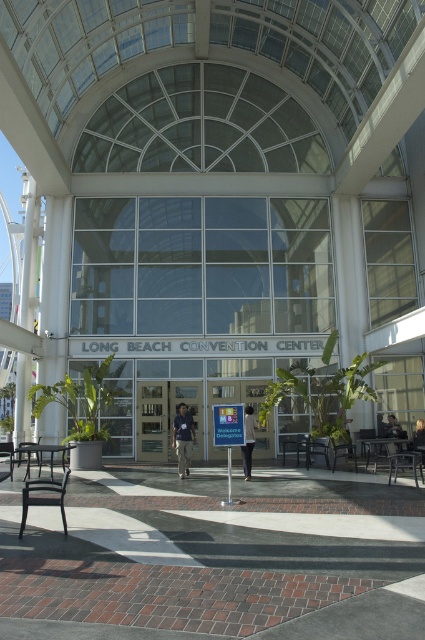
Question: Which of the following is the closest to the observer?

Choices:
 (A) (178, 436)
 (B) (17, 410)
 (C) (249, 477)
 (D) (422, 422)

Answer: (C)

Question: Based on their relative distances, which object is farther from the light brown leather jacket at lower right?

Choices:
 (A) light gray shirt at center
 (B) white glossy pillar at left
 (C) blue denim jeans at center
 (D) wooden door at center

Answer: (B)

Question: In this image, where is blue denim jeans at center located relative to light brown leather jacket at lower right?

Choices:
 (A) below
 (B) above

Answer: (B)

Question: Is white glossy pillar at left wider than light gray shirt at center?

Choices:
 (A) yes
 (B) no

Answer: (A)

Question: Among these objects, which one is nearest to the camera?

Choices:
 (A) light gray shirt at center
 (B) wooden door at center
 (C) white glossy pillar at left
 (D) light brown leather jacket at lower right

Answer: (A)

Question: In this image, where is white glossy pillar at left located relative to light gray shirt at center?

Choices:
 (A) below
 (B) above

Answer: (B)